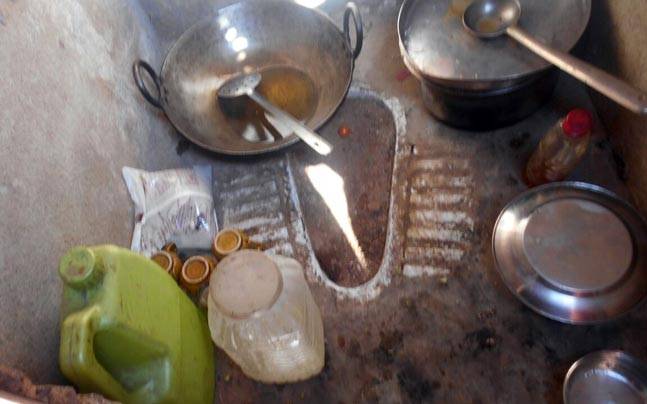
Identify the location of walls. This screenshot has height=404, width=647. (629, 37), (72, 60), (162, 10).